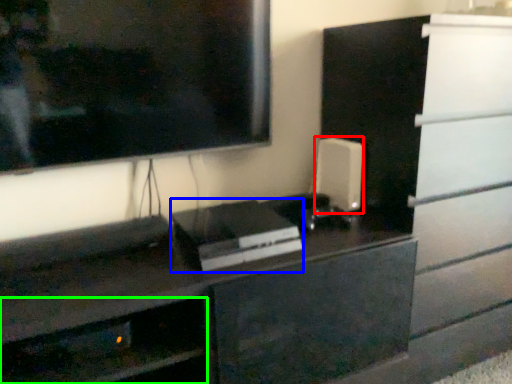
Question: Which is nearer to the appliance (highlighted by a red box)? appliance (highlighted by a blue box) or shelf (highlighted by a green box).

Choices:
 (A) appliance
 (B) shelf

Answer: (A)